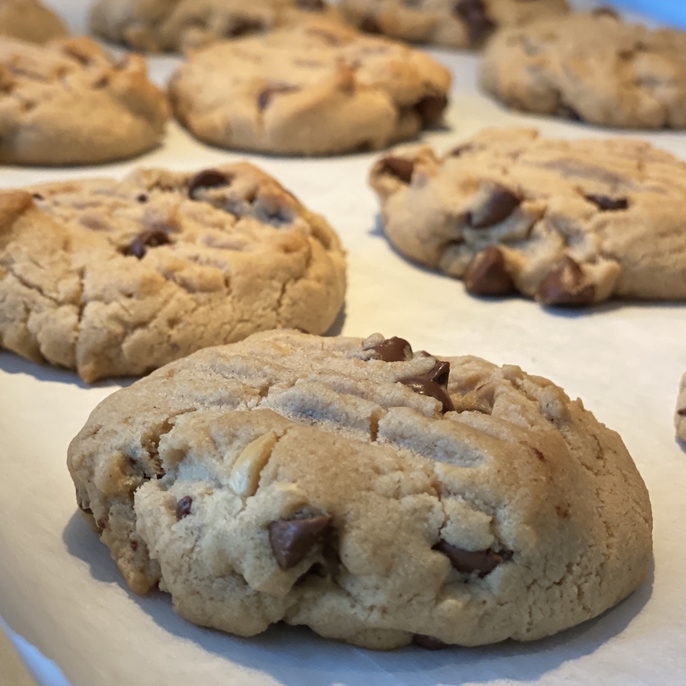
The height and width of the screenshot is (686, 686). Find the location of `white line in side of counter top`. white line in side of counter top is located at coordinates (34, 663).